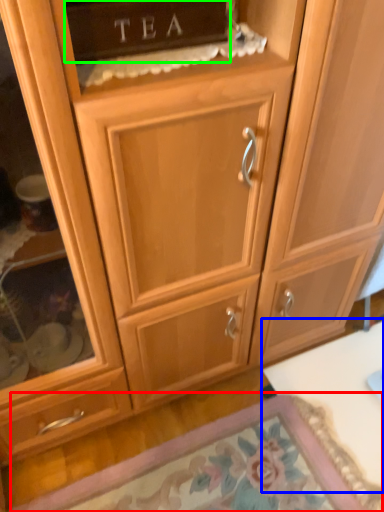
Question: Estimate the real-world distances between objects in this image. Which object is farther from door (highlighted by a red box), table (highlighted by a blue box) or cabinetry (highlighted by a green box)?

Choices:
 (A) table
 (B) cabinetry

Answer: (B)